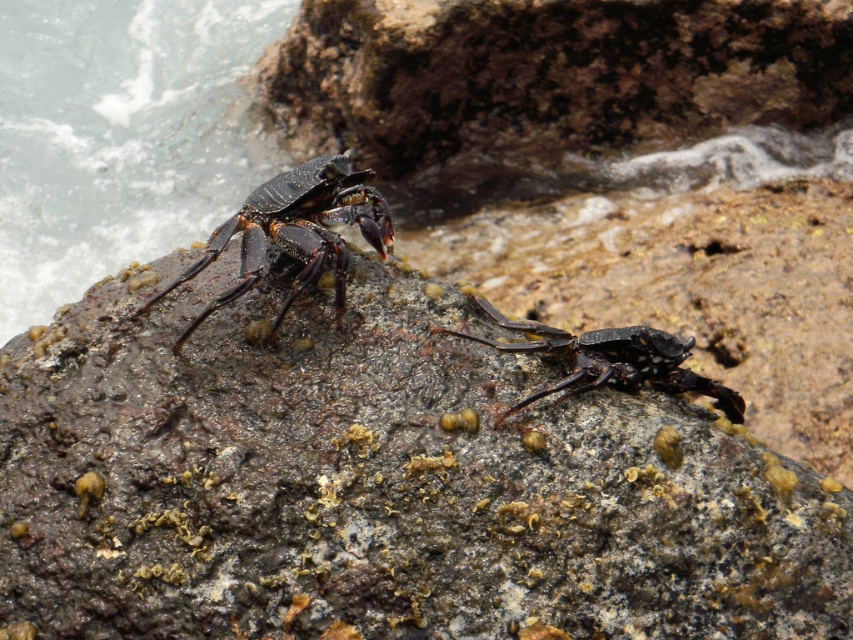
Does rough textured rock at center have a smaller size compared to clear water at left?

Correct, rough textured rock at center occupies less space than clear water at left.

The width and height of the screenshot is (853, 640). What do you see at coordinates (379, 481) in the screenshot?
I see `rough textured rock at center` at bounding box center [379, 481].

Where is `rough textured rock at center`? rough textured rock at center is located at coordinates (379, 481).

Is shiny black crab at upper left smaller than shiny black crab at center?

No.

Is point (242, 230) closer to viewer compared to point (570, 392)?

No, it is behind (570, 392).

Is point (317, 260) farther from camera compared to point (672, 381)?

No, (317, 260) is in front of (672, 381).

Locate an element on the screen. The height and width of the screenshot is (640, 853). shiny black crab at upper left is located at coordinates (294, 230).

Does clear water at left have a greater height compared to shiny black crab at center?

Indeed, clear water at left has a greater height compared to shiny black crab at center.

Is clear water at left below shiny black crab at center?

Incorrect, clear water at left is not positioned below shiny black crab at center.

At what (x,y) coordinates should I click in order to perform the action: click on clear water at left. Please return your answer as a coordinate pair (x, y). Looking at the image, I should click on (120, 136).